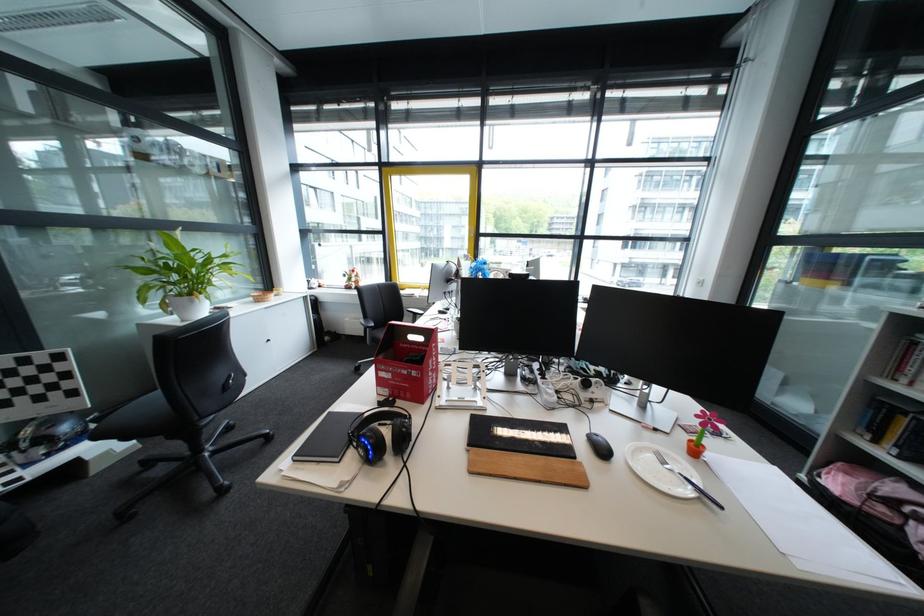
The image size is (924, 616). Describe the element at coordinates (469, 256) in the screenshot. I see `a yellow door handle` at that location.